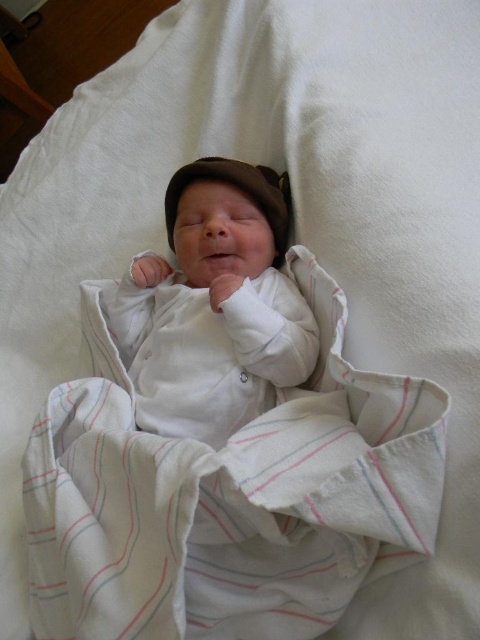
You are a photographer adjusting your camera to focus on two specific points in the image of the baby. The points are labeled as point 1 at coordinates point (x=139, y=273) and point 2 at coordinates point (x=272, y=212). Which point should you focus on first if you want to ensure the closest object is in focus?

Point 1 at coordinates point (x=139, y=273) is closer to the camera than point 2 at coordinates point (x=272, y=212), so you should focus on point 1 first to ensure the closest object is in focus.